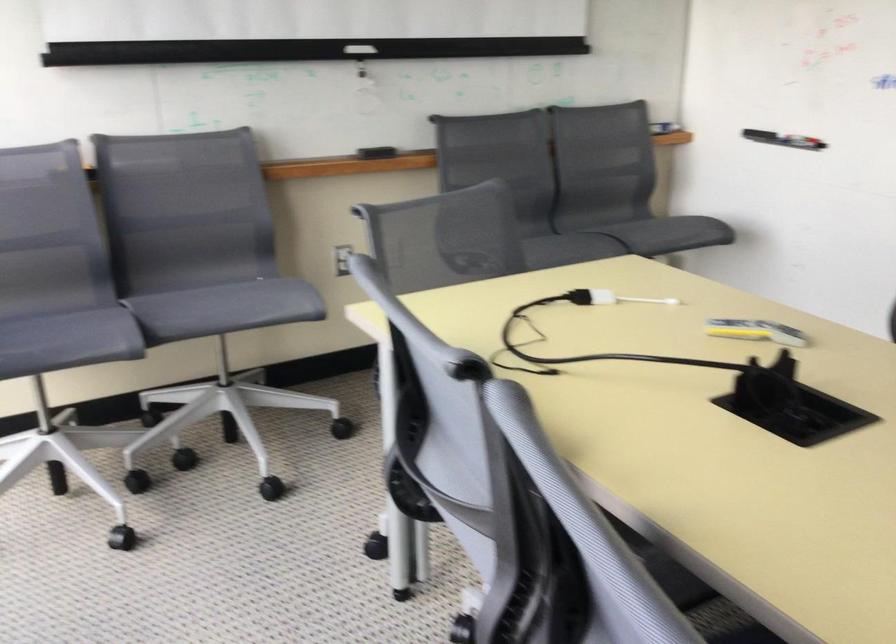
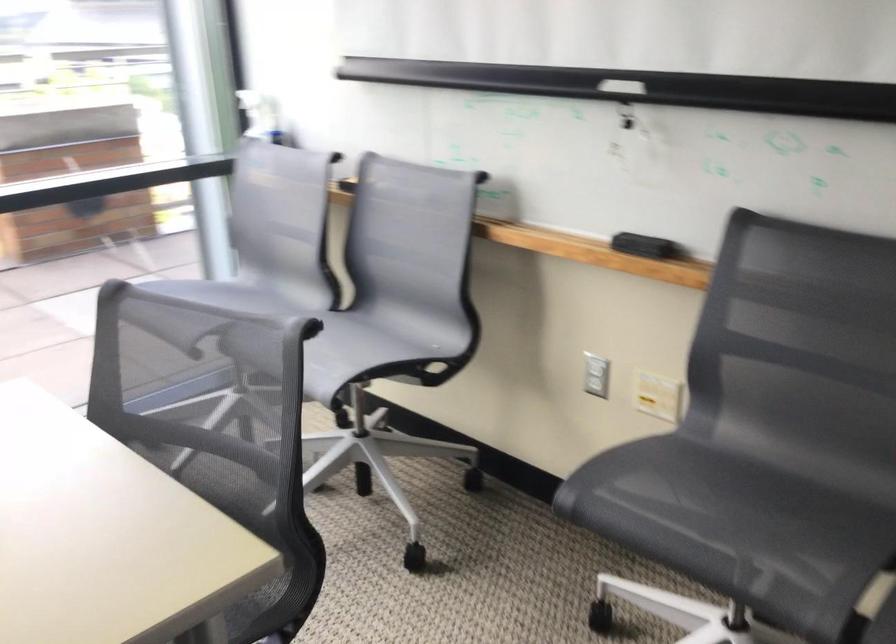
Question: I am providing you with two images of the same scene from different viewpoints. After the viewpoint changes to image2, which objects are now occluded?

Choices:
 (A) chair handle cutout
 (B) blue sofa armrest
 (C) white spray bottle
 (D) chair sitting surface

Answer: (D)